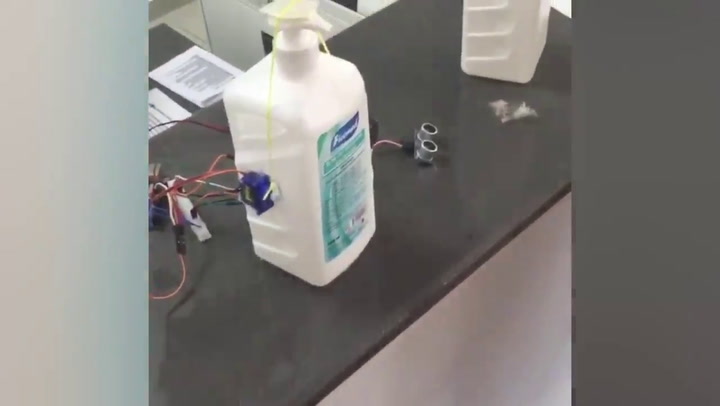
Where is `bottle`? This screenshot has height=406, width=720. bottle is located at coordinates (287, 128).